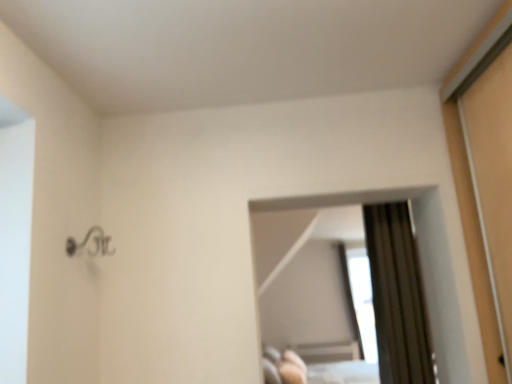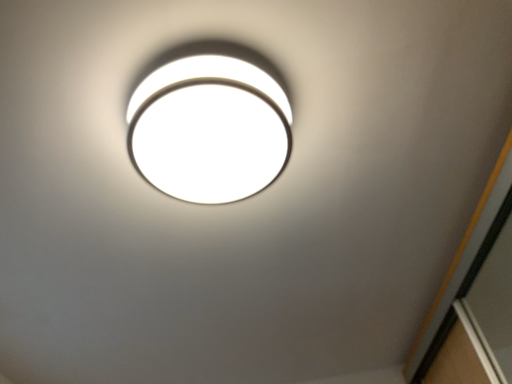
Question: Which way did the camera rotate in the video?

Choices:
 (A) rotated downward
 (B) rotated upward

Answer: (B)